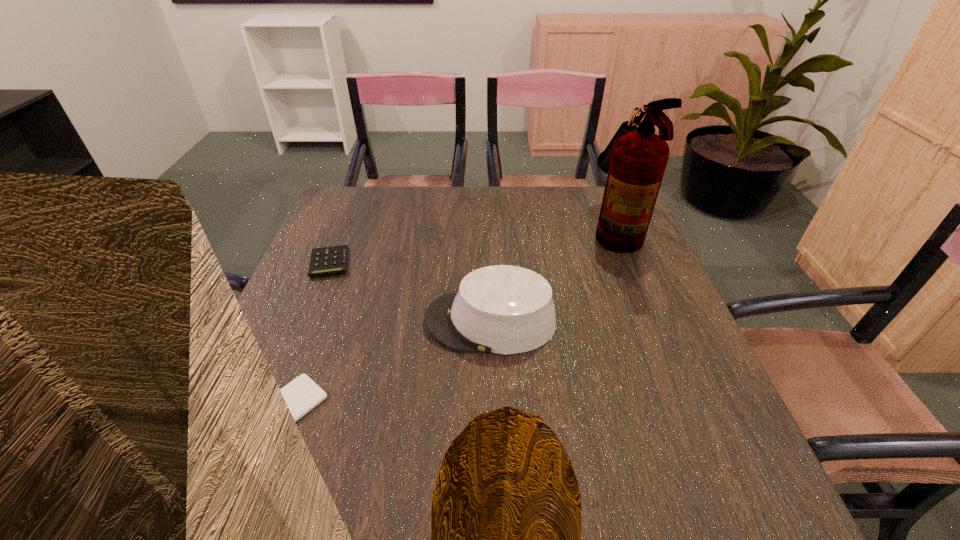
Identify the location of vacant space at the near edge of the desktop. This screenshot has width=960, height=540. (396, 484).

The image size is (960, 540). I want to click on vacant space at the left edge, so click(x=326, y=355).

At what (x,y) coordinates should I click in order to perform the action: click on vacant space at the right edge. Please return your answer as a coordinate pair (x, y). This screenshot has height=540, width=960. Looking at the image, I should click on pos(634,253).

At what (x,y) coordinates should I click in order to perform the action: click on free space at the far left corner of the desktop. Please return your answer as a coordinate pair (x, y). Looking at the image, I should click on (346, 197).

Identify the location of free region at the far right corner of the desktop. The image size is (960, 540). (580, 199).

This screenshot has width=960, height=540. In the image, there is a desktop. Identify the location of free space at the near right corner. (680, 523).

Image resolution: width=960 pixels, height=540 pixels. Identify the location of vacant space in between the third farthest object and the rightmost object. (553, 275).

Where is `vacant space that is in between the fire extinguisher and the third object from left to right`? The height and width of the screenshot is (540, 960). vacant space that is in between the fire extinguisher and the third object from left to right is located at coordinates (553, 275).

Locate an element on the screen. blank region between the taller calculator and the shortest object is located at coordinates (309, 334).

The image size is (960, 540). Find the location of `empty space that is in between the third tallest object and the rightmost object`. empty space that is in between the third tallest object and the rightmost object is located at coordinates (472, 246).